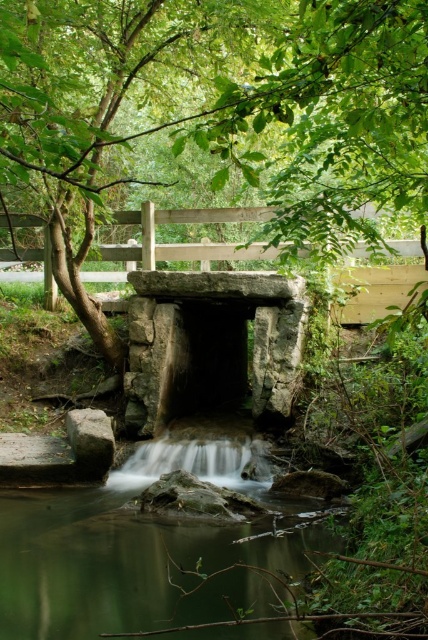
You are standing at the stone culvert at the center and want to walk towards the wooden bridge in the background. Which point, point (x=282, y=118) or point (x=199, y=588), is closer to your current position?

Point (x=282, y=118) is closer to your current position at the stone culvert because it is in front of point (x=199, y=588).

You are standing at the edge of the waterway and want to reach the green leafy tree at center. The path you need to take is 4 feet long. Can you make it without needing to adjust your path?

The distance between you and the green leafy tree at center is 4.14 feet, which is slightly longer than the 4 feet path you mentioned. Therefore, you might need to adjust your path to cover the extra 0.14 feet.

You are a hiker who wants to cross the waterway at the center of the scene. You have a small backpack and are wearing waterproof shoes. The smooth gray stone waterfall at center is in your path. Can you safely step over the green translucent water at center without getting your shoes wet?

The green translucent water at center is much taller than the smooth gray stone waterfall at center, so stepping over it may result in getting your shoes wet. You should look for another way to cross the waterway safely.